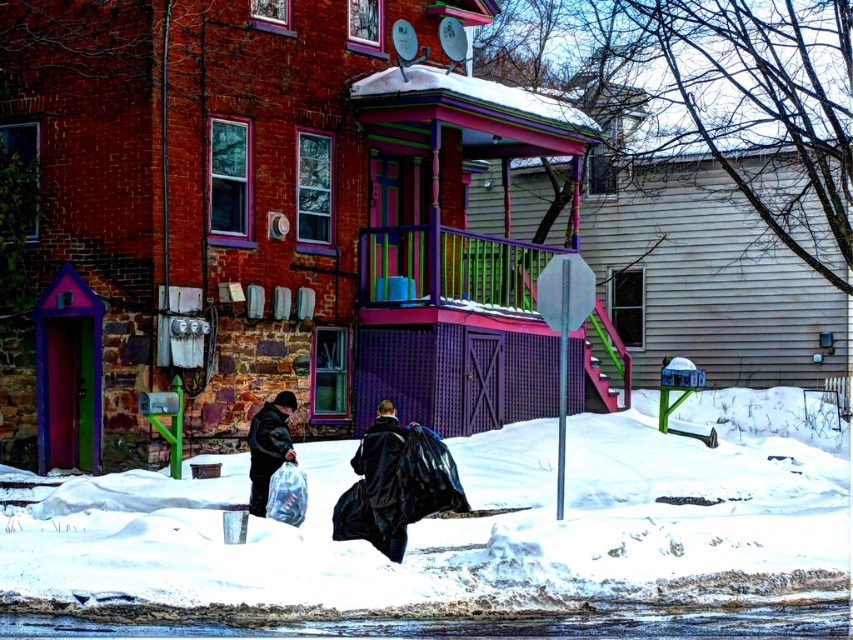
Is white fluffy snow at lower center further to camera compared to matte black jacket at lower left?

No, it is not.

In the scene shown: Can you confirm if white fluffy snow at lower center is wider than matte black jacket at lower left?

Correct, the width of white fluffy snow at lower center exceeds that of matte black jacket at lower left.

What are the coordinates of `white fluffy snow at lower center` in the screenshot? It's located at click(x=469, y=528).

The height and width of the screenshot is (640, 853). I want to click on white fluffy snow at lower center, so [469, 528].